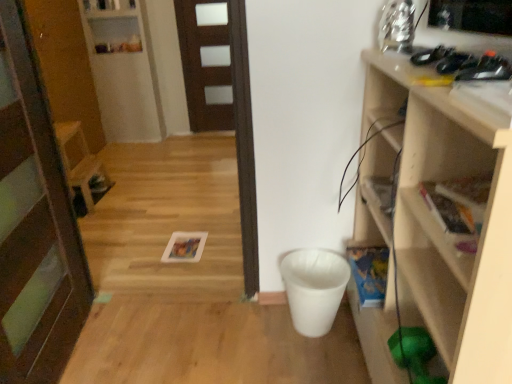
Question: Is brown matte door at center, which appears as the second door when viewed from the front, shorter than wooden door at center, which is the 1th door in bottom-to-top order?

Choices:
 (A) yes
 (B) no

Answer: (A)

Question: Are brown matte door at center, which is the 2th door in left-to-right order, and wooden door at center, which ranks as the 1th door in left-to-right order, located far from each other?

Choices:
 (A) no
 (B) yes

Answer: (B)

Question: Considering the relative sizes of brown matte door at center, acting as the first door starting from the top, and wooden door at center, the 2th door in the back-to-front sequence, in the image provided, is brown matte door at center, acting as the first door starting from the top, smaller than wooden door at center, the 2th door in the back-to-front sequence,?

Choices:
 (A) yes
 (B) no

Answer: (A)

Question: Is brown matte door at center, which is the 2th door in left-to-right order, taller than wooden door at center, which is the 1th door in bottom-to-top order?

Choices:
 (A) yes
 (B) no

Answer: (B)

Question: From the image's perspective, is brown matte door at center, placed as the 1th door when sorted from back to front, on wooden door at center, which appears as the first door when viewed from the front?

Choices:
 (A) yes
 (B) no

Answer: (A)

Question: Does point (202, 46) appear closer or farther from the camera than point (32, 84)?

Choices:
 (A) closer
 (B) farther

Answer: (B)

Question: Relative to wooden door at center, the 2th door from the top, is brown matte door at center, acting as the first door starting from the top, in front or behind?

Choices:
 (A) behind
 (B) front

Answer: (A)

Question: From the image's perspective, is brown matte door at center, acting as the first door starting from the right, positioned above or below wooden door at center, the 2th door from the top?

Choices:
 (A) above
 (B) below

Answer: (A)

Question: Considering the relative positions of brown matte door at center, placed as the 1th door when sorted from back to front, and wooden door at center, which ranks as the 1th door in left-to-right order, in the image provided, is brown matte door at center, placed as the 1th door when sorted from back to front, to the left or to the right of wooden door at center, which ranks as the 1th door in left-to-right order,?

Choices:
 (A) right
 (B) left

Answer: (A)

Question: Considering their positions, is brown matte door at center, the second door ordered from the bottom, located in front of or behind wooden chair at left?

Choices:
 (A) behind
 (B) front

Answer: (A)

Question: Would you say brown matte door at center, acting as the first door starting from the top, is to the left or to the right of wooden chair at left in the picture?

Choices:
 (A) right
 (B) left

Answer: (A)

Question: Considering the positions of brown matte door at center, placed as the 1th door when sorted from back to front, and wooden chair at left in the image, is brown matte door at center, placed as the 1th door when sorted from back to front, wider or thinner than wooden chair at left?

Choices:
 (A) wide
 (B) thin

Answer: (B)

Question: Based on their sizes in the image, would you say brown matte door at center, acting as the first door starting from the right, is bigger or smaller than wooden chair at left?

Choices:
 (A) small
 (B) big

Answer: (A)

Question: From a real-world perspective, relative to white glossy shelf at upper left, the second shelf when ordered from bottom to top, is wooden chair at left vertically above or below?

Choices:
 (A) below
 (B) above

Answer: (A)

Question: Looking at their shapes, would you say wooden chair at left is wider or thinner than white glossy shelf at upper left, the first shelf positioned from the left?

Choices:
 (A) wide
 (B) thin

Answer: (A)